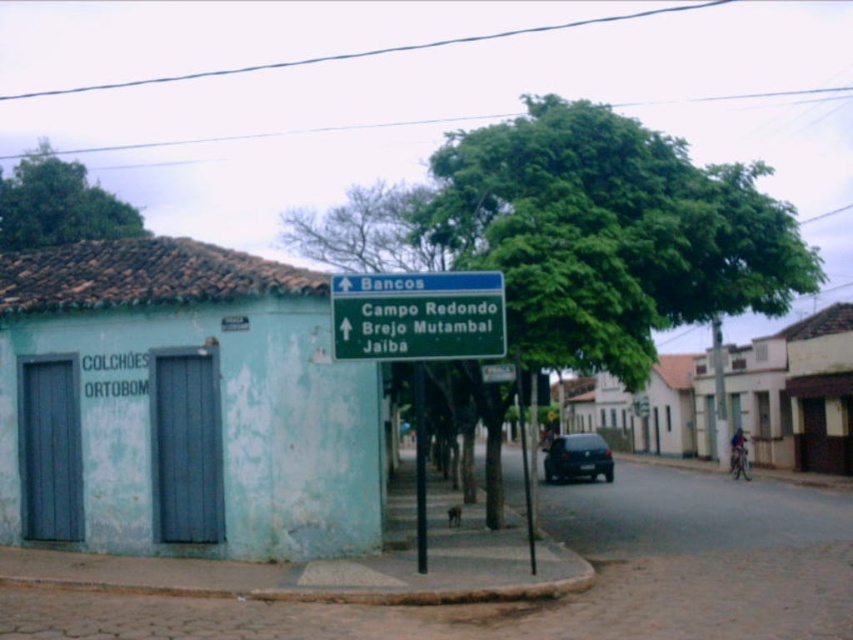
Is green plastic sign at upper center taller than green leafy tree at upper left?

In fact, green plastic sign at upper center may be shorter than green leafy tree at upper left.

Is green plastic sign at upper center shorter than green leafy tree at upper left?

Indeed, green plastic sign at upper center has a lesser height compared to green leafy tree at upper left.

Is point (387, 324) less distant than point (25, 180)?

That is True.

Where is `green plastic sign at upper center`? This screenshot has width=853, height=640. green plastic sign at upper center is located at coordinates (418, 316).

Is green leafy tree at center to the left of green plastic sign at upper center from the viewer's perspective?

In fact, green leafy tree at center is to the right of green plastic sign at upper center.

Who is more forward, (637, 148) or (437, 328)?

Point (437, 328) is in front.

Does point (698, 244) come behind point (374, 321)?

Yes.

Identify the location of green leafy tree at center. (608, 234).

Can you confirm if shiny black car at center is thinner than green metallic pole at center?

In fact, shiny black car at center might be wider than green metallic pole at center.

Can you confirm if shiny black car at center is positioned to the left of green metallic pole at center?

In fact, shiny black car at center is to the right of green metallic pole at center.

Does point (583, 458) lie behind point (415, 440)?

No.

This screenshot has width=853, height=640. What are the coordinates of `shiny black car at center` in the screenshot? It's located at [577, 458].